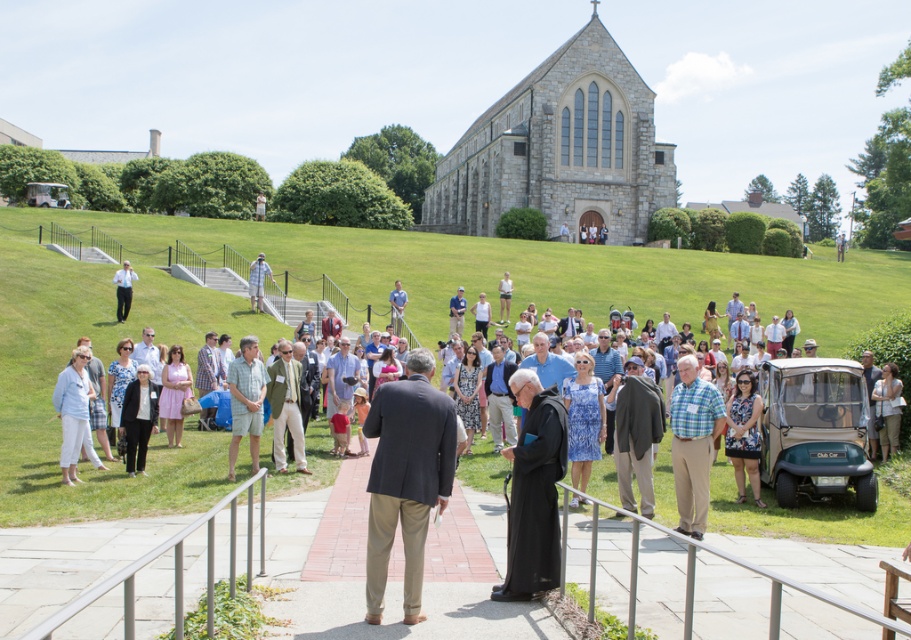
You are attending an event at the church and see two people wearing a plaid shirt at center and a blue shirt at center. Which person is standing to the right of the other?

The plaid shirt at center is to the right of the blue shirt at center.

You are organizing a photo shoot and need to position two props, the black matte robe at center and the light blue denim shorts at center, in a way that their sizes are accurately represented. Based on the scene, which prop should you place closer to the camera to maintain their relative sizes as seen in the image?

The black matte robe at center occupies less space than the light blue denim shorts at center, so to maintain their relative sizes, the black matte robe at center should be placed closer to the camera.

You are standing at the entrance of the church and want to greet two people wearing the black matte robe at center and light blue denim shorts at center. Which one should you approach first if you want to greet the person closest to you?

You should approach the black matte robe at center first because it is closer to you than the light blue denim denim shorts at center.